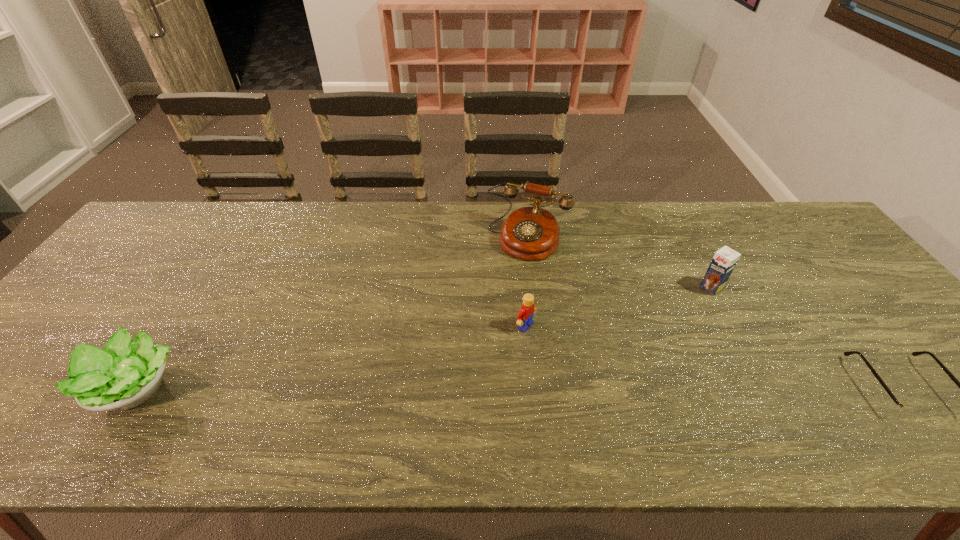
Identify the location of the leftmost object. (126, 373).

Identify the location of telephone. The height and width of the screenshot is (540, 960). (531, 233).

Where is `the farthest object`? This screenshot has width=960, height=540. the farthest object is located at coordinates (531, 233).

You are a GUI agent. You are given a task and a screenshot of the screen. Output one action in this format:
    pyautogui.click(x=<x>, y=<y>)
    Task: Click on the Lego
    
    Given the screenshot: What is the action you would take?
    pyautogui.click(x=525, y=315)

What are the coordinates of `the second tallest object` in the screenshot? It's located at (725, 259).

Identify the location of chocolate milk. (725, 259).

In order to click on free location located 0.140m on the left of the lettuce in this screenshot , I will do `click(26, 387)`.

The image size is (960, 540). Identify the location of vacant region located 0.310m on the dial of the telephone. (477, 339).

The height and width of the screenshot is (540, 960). I want to click on vacant region located on the dial of the telephone, so click(476, 341).

Identify the location of blank space located 0.280m on the dial of the telephone. (482, 329).